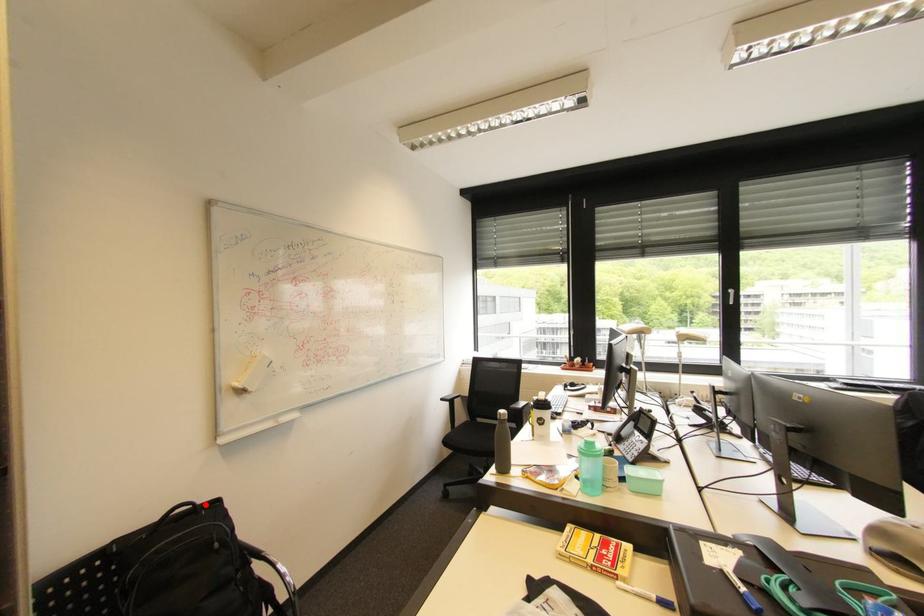
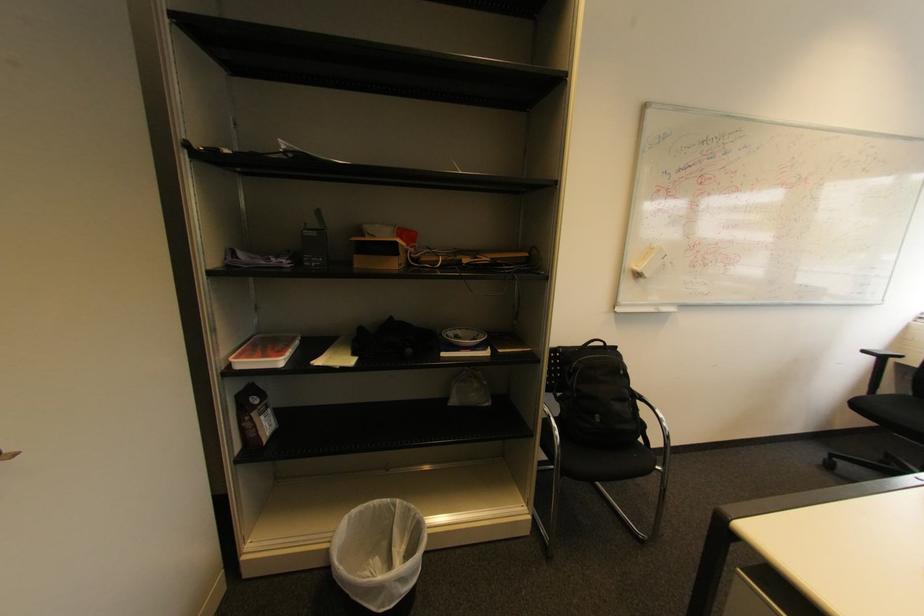
In the second image, find the point that corresponds to the highlighted location in the first image.

(613, 345)